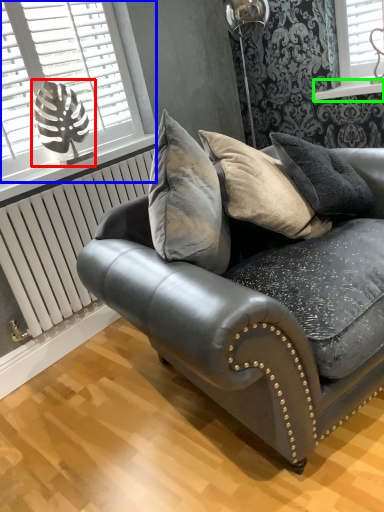
Question: Estimate the real-world distances between objects in this image. Which object is closer to table lamp (highlighted by a red box), window (highlighted by a blue box) or window sill (highlighted by a green box)?

Choices:
 (A) window
 (B) window sill

Answer: (A)